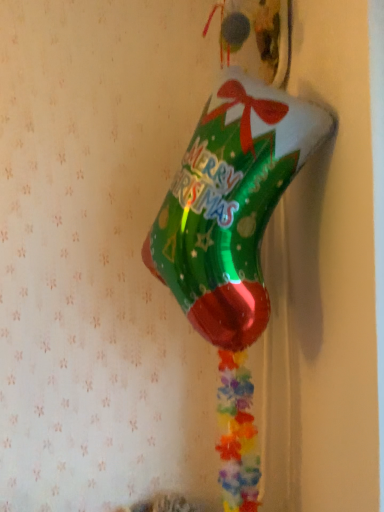
The image size is (384, 512). What are the coordinates of `green metallic balloon at center` in the screenshot? It's located at (231, 205).

This screenshot has width=384, height=512. What do you see at coordinates (231, 205) in the screenshot? I see `green metallic balloon at center` at bounding box center [231, 205].

Identify the location of green metallic balloon at center. Image resolution: width=384 pixels, height=512 pixels. (231, 205).